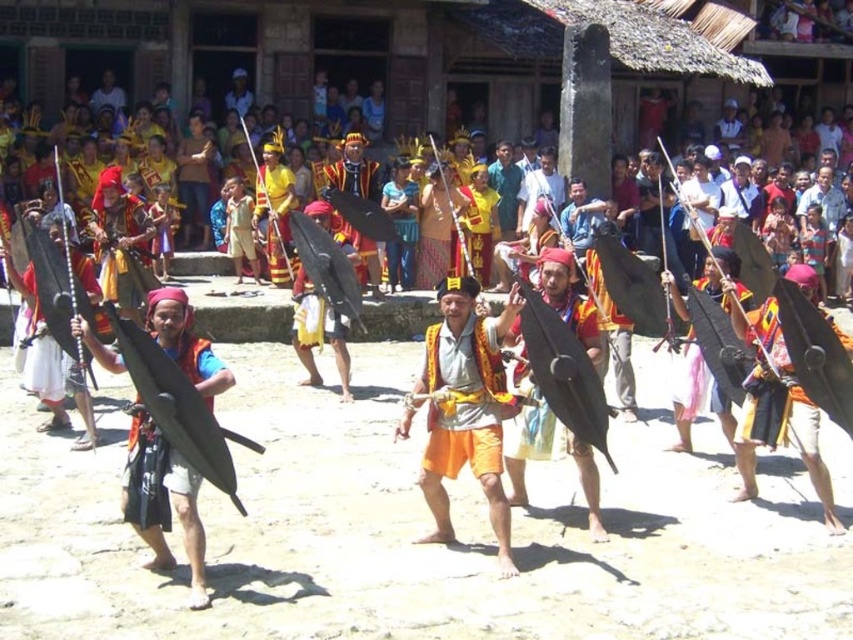
Does orange fabric at center appear on the right side of matte black shield at center?

Incorrect, orange fabric at center is not on the right side of matte black shield at center.

Does point (485, 419) come farther from viewer compared to point (544, 436)?

That is False.

Where is `orange fabric at center`? The height and width of the screenshot is (640, 853). orange fabric at center is located at coordinates (466, 408).